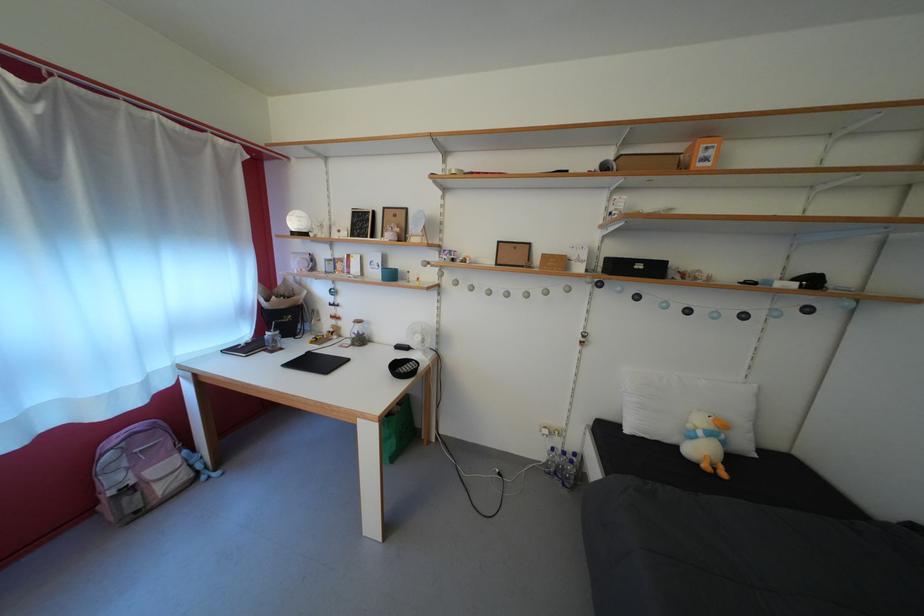
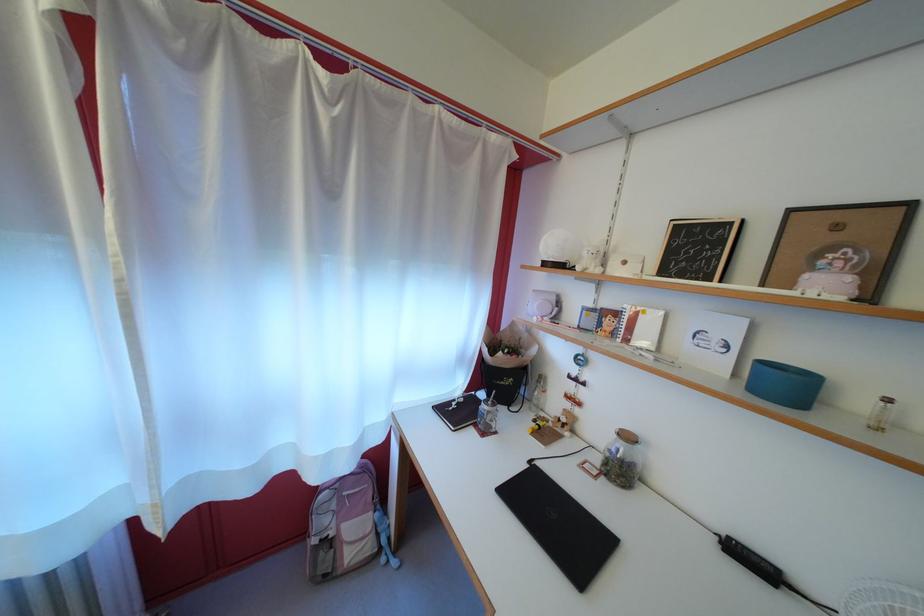
Where in the second image is the point corresponding to point (212, 484) from the first image?

(392, 565)